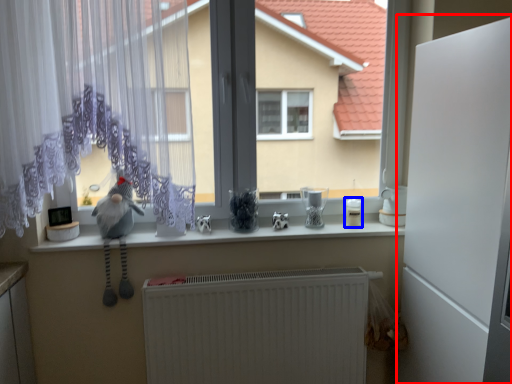
Question: Among these objects, which one is farthest to the camera, screen door (highlighted by a red box) or appliance (highlighted by a blue box)?

Choices:
 (A) screen door
 (B) appliance

Answer: (B)